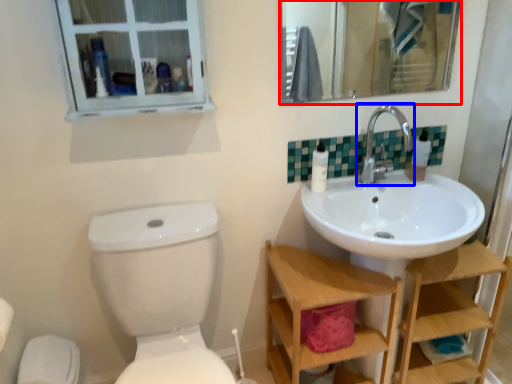
Question: Among these objects, which one is nearest to the camera, mirror (highlighted by a red box) or tap (highlighted by a blue box)?

Choices:
 (A) mirror
 (B) tap

Answer: (B)